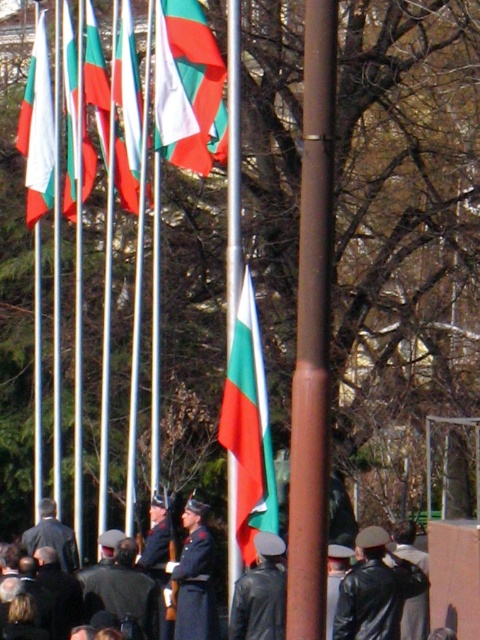
You are attending a formal ceremony where flags are displayed. You need to determine the distance to a specific point marked as point (199, 589) in the scene. Can you estimate how far this point is from your current position?

The point (199, 589) is 41.55 meters away from the viewer.

You are a photographer positioned at the origin point in the scene. You need to capture a photo of the black leather uniform at center. What are the coordinates where you should aim your camera?

The black leather uniform at center is located at coordinates [124,595], so you should aim your camera at those coordinates to capture the subject.